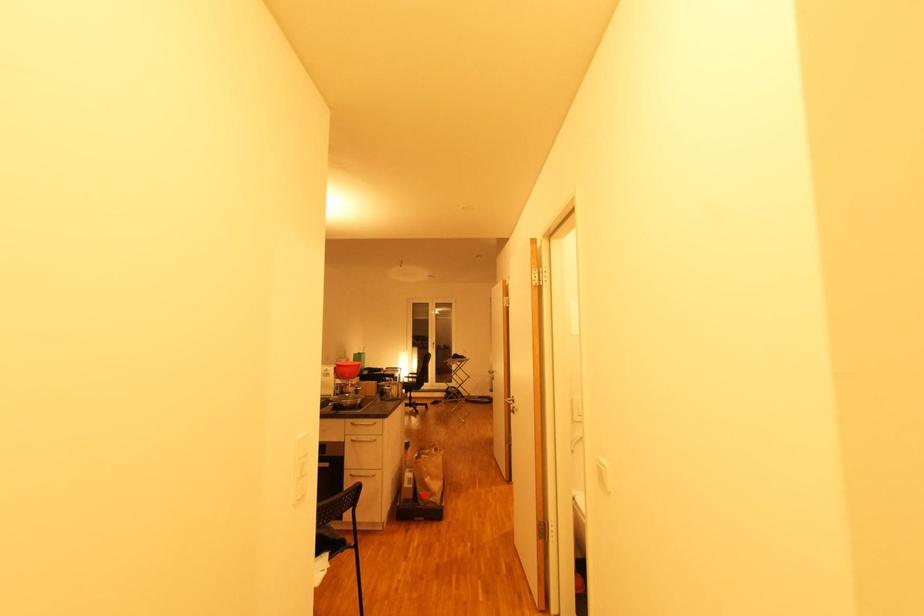
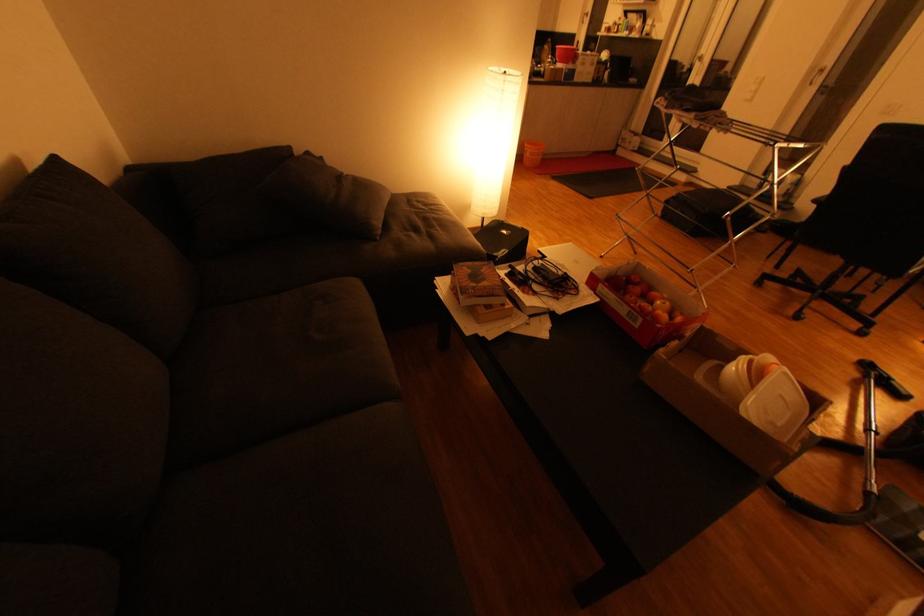
Question: I am providing you with two images of the same scene from different viewpoints. A red point is marked on the first image. At the location where the point appears in image 1, is it still visible in image 2?

Choices:
 (A) Yes
 (B) No

Answer: (B)